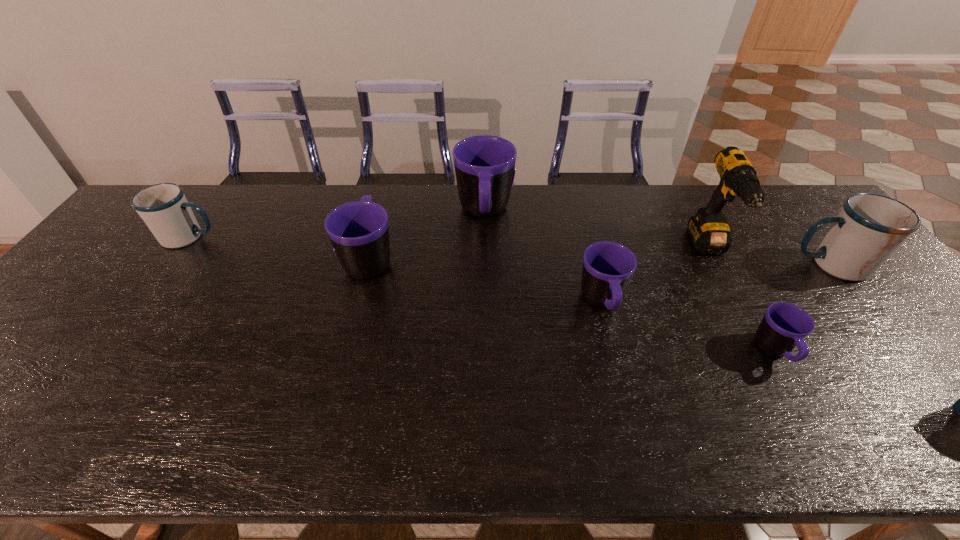
Locate an element on the screen. The height and width of the screenshot is (540, 960). vacant space located with the handle on the side of the second biggest black mug is located at coordinates (387, 193).

Locate an element on the screen. Image resolution: width=960 pixels, height=540 pixels. vacant space located 0.140m with the handle on the side of the second biggest black mug is located at coordinates (383, 206).

Identify the location of blank area located 0.330m on the handle side of the smaller white mug. (327, 237).

Identify the location of blank space located 0.150m with the handle on the side of the third biggest black mug. Image resolution: width=960 pixels, height=540 pixels. (623, 383).

This screenshot has width=960, height=540. I want to click on vacant space located with the handle on the side of the rightmost black mug, so click(x=826, y=441).

Find the location of `drill positioned at the far edge`. drill positioned at the far edge is located at coordinates (709, 231).

Where is `object located at the left edge`? This screenshot has height=540, width=960. object located at the left edge is located at coordinates (164, 208).

Image resolution: width=960 pixels, height=540 pixels. Identify the location of object located at the right edge. (869, 228).

Where is `object located at the far left corner`? The height and width of the screenshot is (540, 960). object located at the far left corner is located at coordinates (164, 208).

In the image, there is a desktop. Find the location of `blank space at the far edge`. blank space at the far edge is located at coordinates (364, 185).